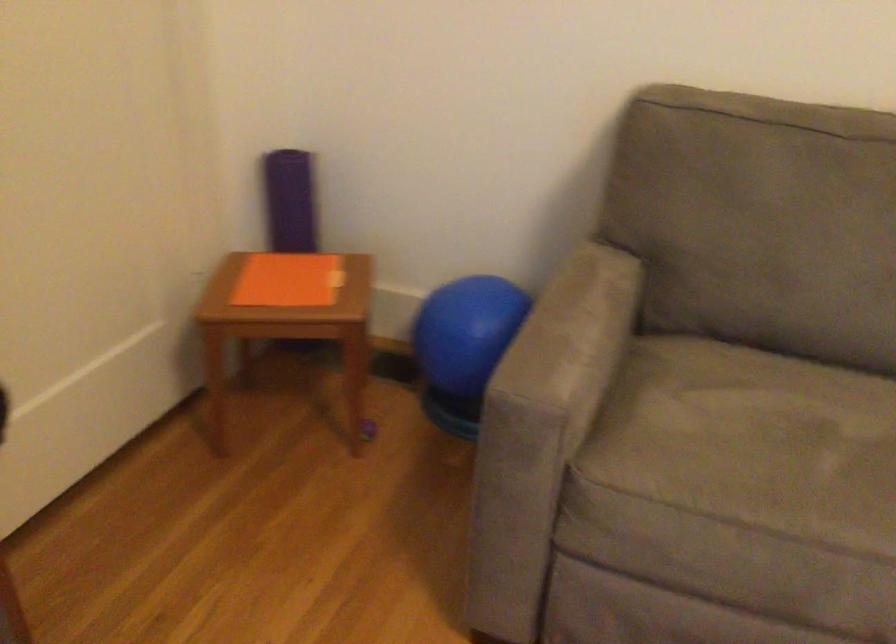
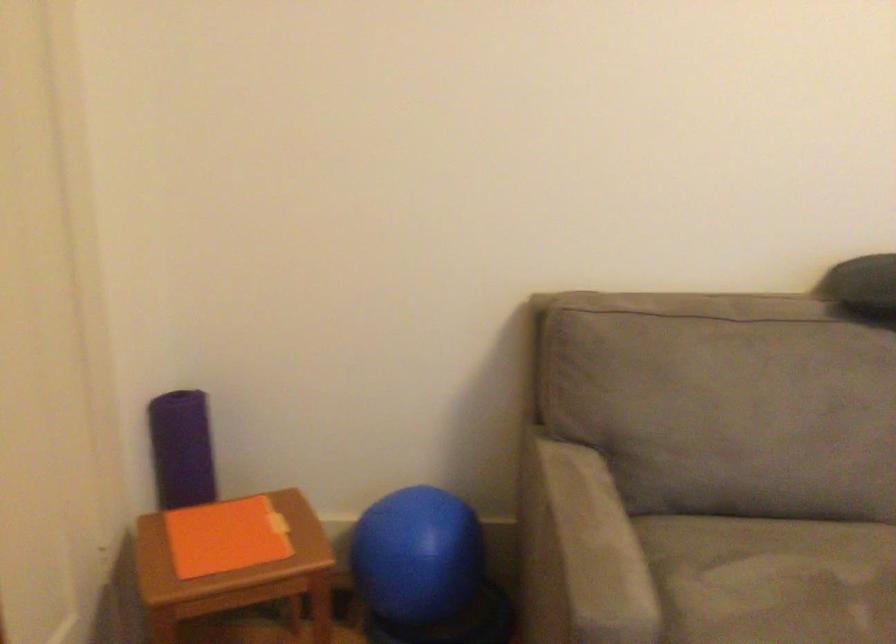
Where in the second image is the point corresponding to point (459, 334) from the first image?

(417, 554)